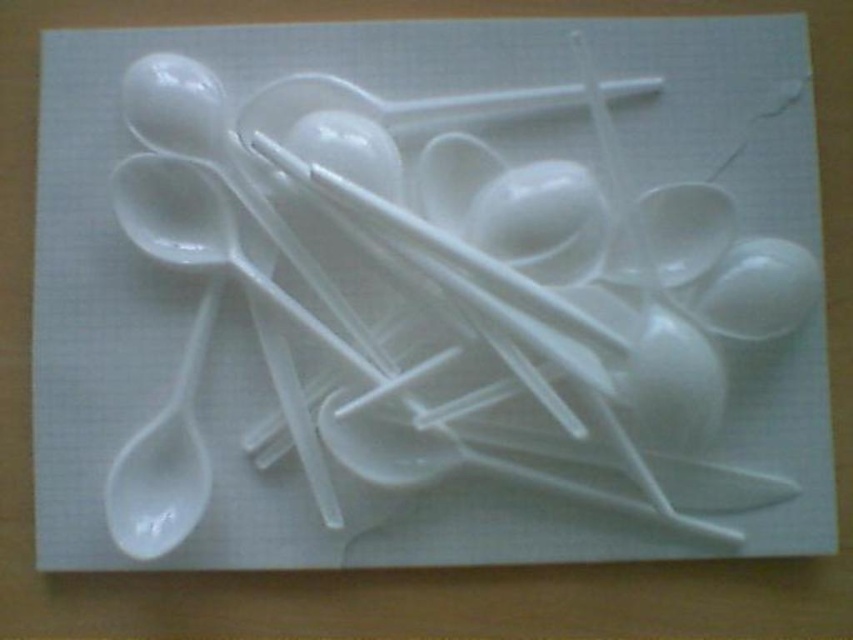
Question: Can you confirm if white plastic spoon at center is thinner than white matte spoon at left?

Choices:
 (A) yes
 (B) no

Answer: (B)

Question: Can you confirm if white plastic spoon at center is thinner than white glossy spoon at center?

Choices:
 (A) no
 (B) yes

Answer: (A)

Question: Which object is closer to the camera taking this photo?

Choices:
 (A) white glossy spoon at center
 (B) white plastic spoon at center
 (C) white matte spoon at left

Answer: (C)

Question: Considering the real-world distances, which object is farthest from the white matte spoon at left?

Choices:
 (A) white plastic spoon at center
 (B) white glossy spoon at center

Answer: (B)

Question: Is white matte spoon at left smaller than white glossy spoon at center?

Choices:
 (A) no
 (B) yes

Answer: (A)

Question: Which point is closer to the camera?

Choices:
 (A) (194, 358)
 (B) (747, 262)

Answer: (B)